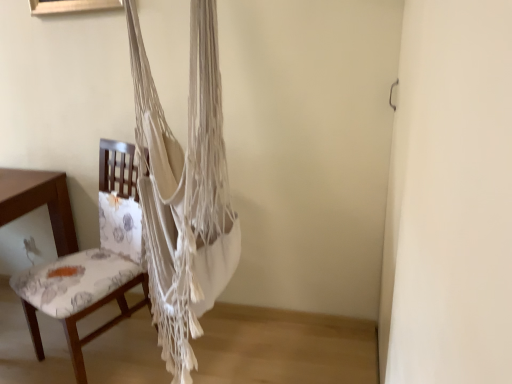
Question: Is white macrame hammock at center wider or thinner than floral fabric chair at left?

Choices:
 (A) thin
 (B) wide

Answer: (A)

Question: In terms of height, does white macrame hammock at center look taller or shorter compared to floral fabric chair at left?

Choices:
 (A) tall
 (B) short

Answer: (A)

Question: From the image's perspective, relative to floral fabric chair at left, is white macrame hammock at center above or below?

Choices:
 (A) below
 (B) above

Answer: (B)

Question: Considering the positions of point (53, 210) and point (156, 187), is point (53, 210) closer or farther from the camera than point (156, 187)?

Choices:
 (A) closer
 (B) farther

Answer: (B)

Question: From the image's perspective, relative to white macrame hammock at center, is floral fabric chair at left above or below?

Choices:
 (A) below
 (B) above

Answer: (A)

Question: From their relative heights in the image, would you say floral fabric chair at left is taller or shorter than white macrame hammock at center?

Choices:
 (A) short
 (B) tall

Answer: (A)

Question: From a real-world perspective, relative to white macrame hammock at center, is floral fabric chair at left vertically above or below?

Choices:
 (A) below
 (B) above

Answer: (A)